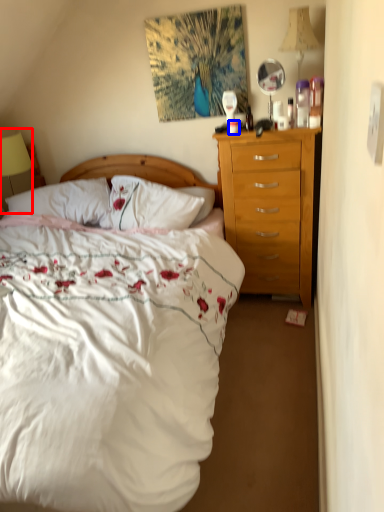
Question: Which object appears closest to the camera in this image, lamp (highlighted by a red box) or coffee cup (highlighted by a blue box)?

Choices:
 (A) lamp
 (B) coffee cup

Answer: (B)